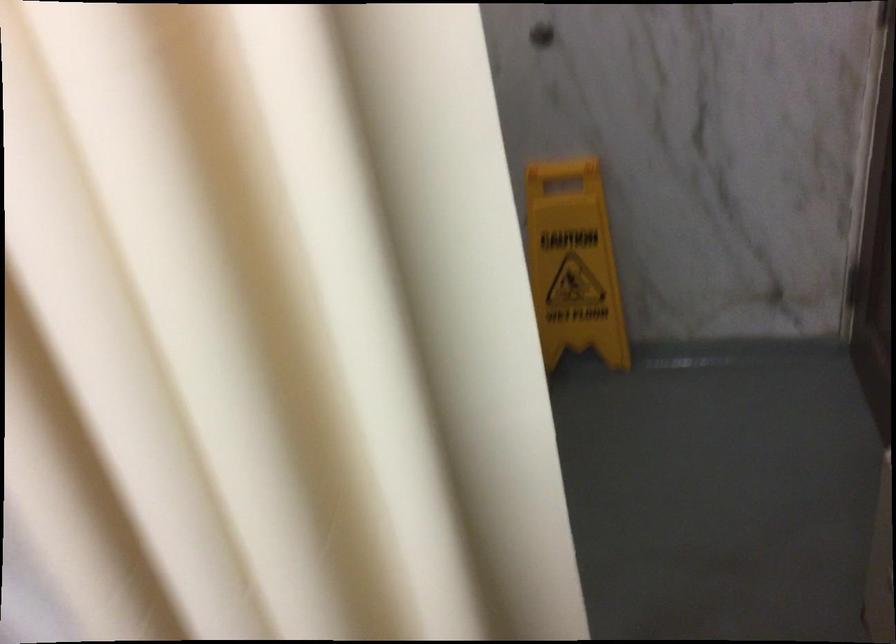
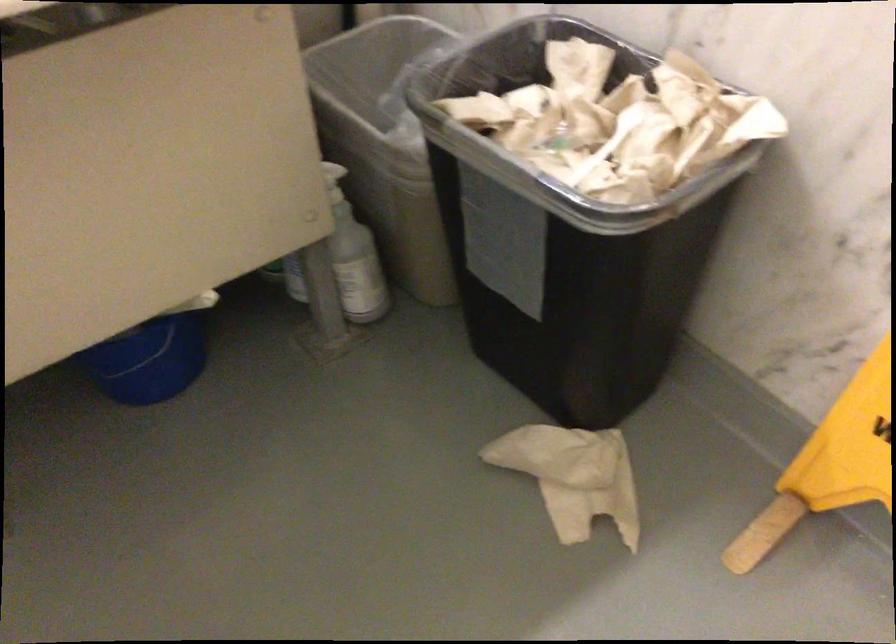
In the second image, find the point that corresponds to (x=544, y=344) in the first image.

(830, 464)